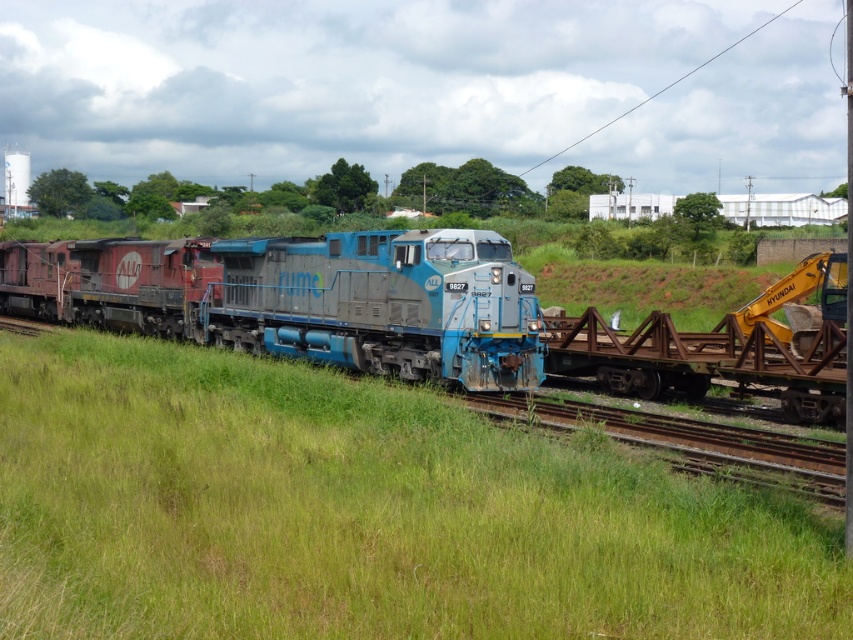
You are standing at the point where the blue locomotive labeled Rume is located. Looking towards the green grassy area at center, which is at point (363, 513), in which direction should you walk to reach it?

The green grassy area at center is located at point (363, 513), so you should walk forward in the direction of the tracks to reach it.

You are a railway inspector checking the area between the green grassy at center and the rusty metal rail at right. Which area has a smaller size?

The green grassy at center has a smaller size compared to the rusty metal rail at right.